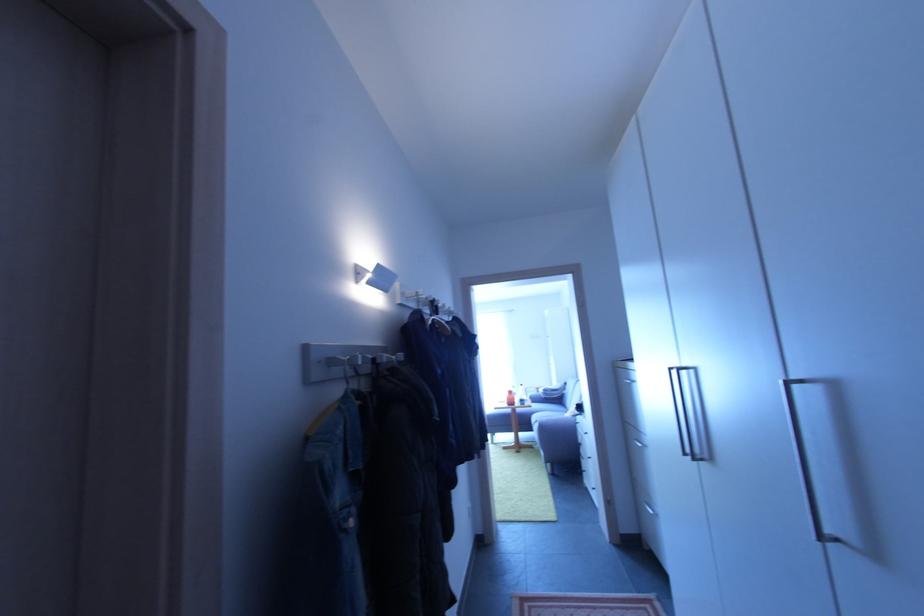
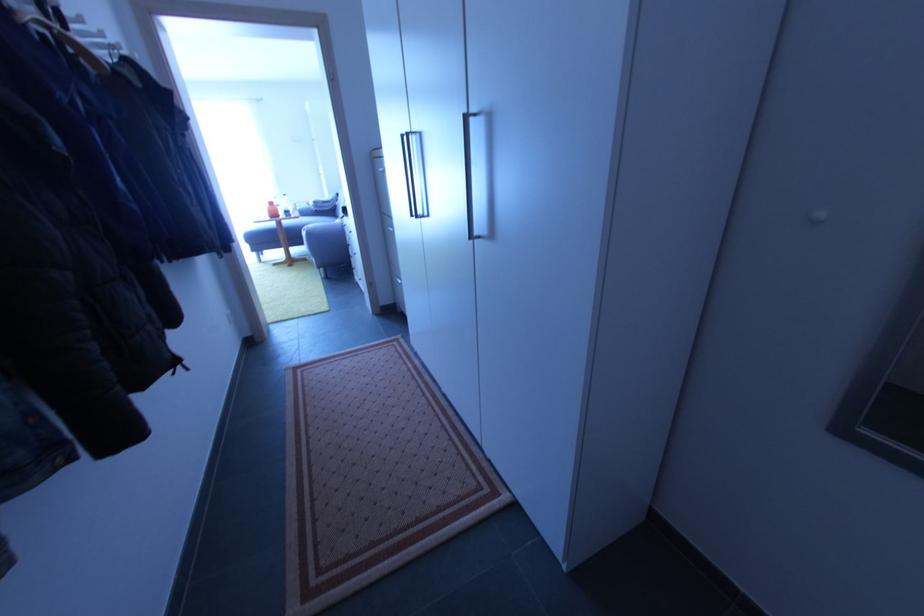
Find the pixel in the second image that matches [536,432] in the first image.

(308, 245)